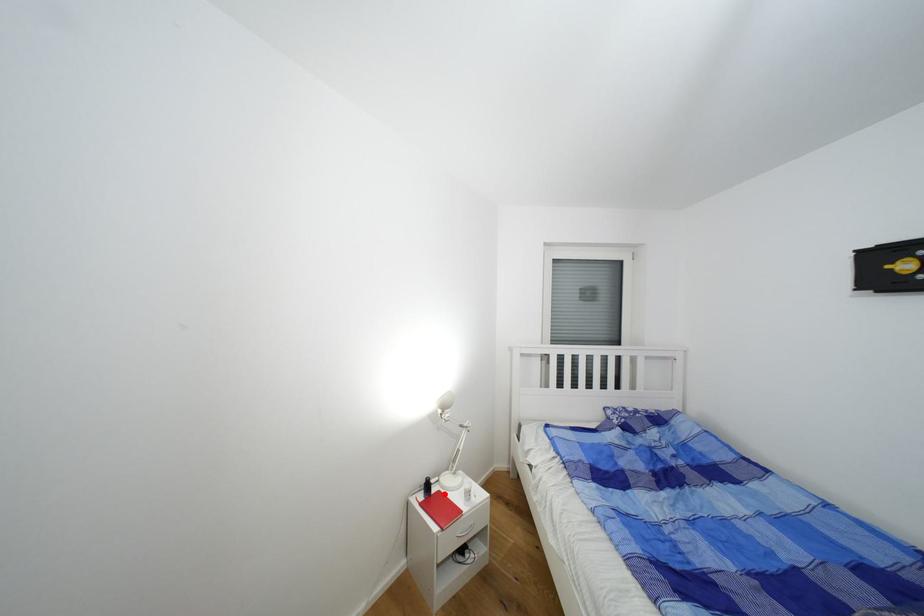
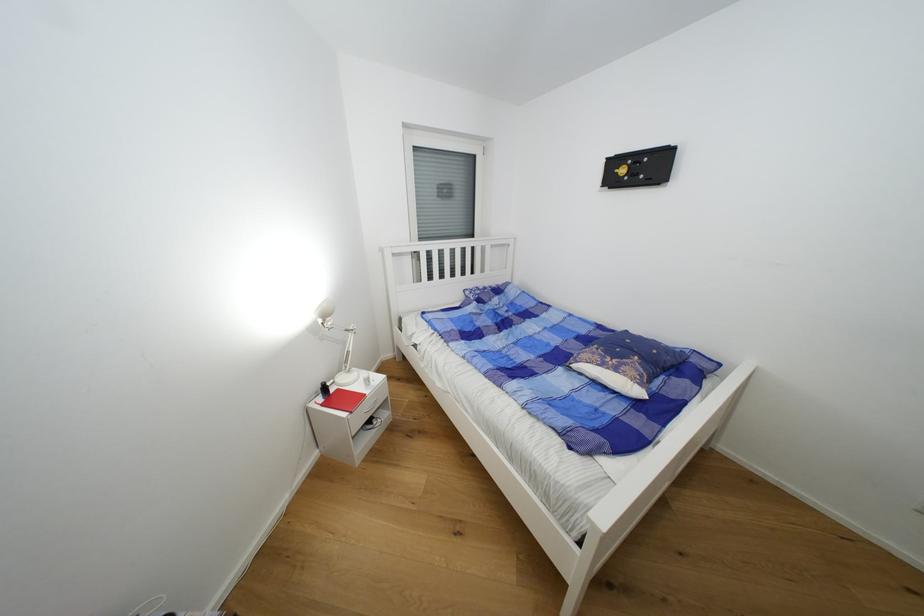
The point at the highlighted location is marked in the first image. Where is the corresponding point in the second image?

(344, 392)